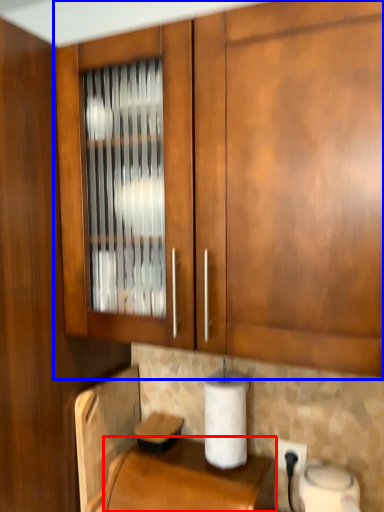
Question: Among these objects, which one is farthest to the camera, counter top (highlighted by a red box) or cabinetry (highlighted by a blue box)?

Choices:
 (A) counter top
 (B) cabinetry

Answer: (A)